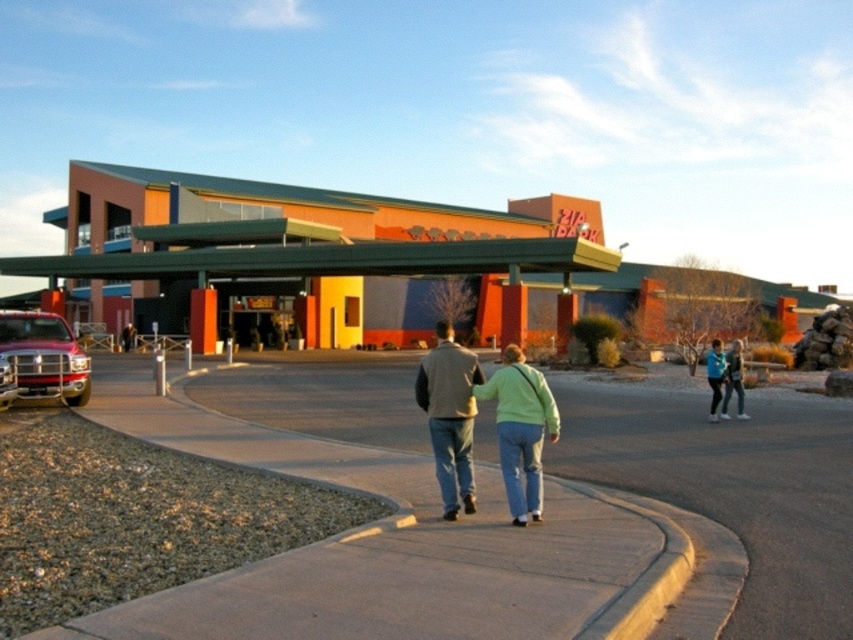
Question: Which point is farther from the camera taking this photo?

Choices:
 (A) (38, 380)
 (B) (467, 561)
 (C) (735, 376)
 (D) (119, 173)

Answer: (D)

Question: Is concrete at center thinner than light blue sweater at center?

Choices:
 (A) no
 (B) yes

Answer: (A)

Question: Is metallic red truck at left thinner than light blue sweater at center?

Choices:
 (A) no
 (B) yes

Answer: (A)

Question: Estimate the real-world distances between objects in this image. Which object is closer to the concrete at center?

Choices:
 (A) light green sweater at center
 (B) orange matte building at center
 (C) gray fleece jacket at center
 (D) light blue sweater at center

Answer: (C)

Question: Which object is positioned closest to the light green sweater at center?

Choices:
 (A) metallic red truck at left
 (B) orange matte building at center
 (C) concrete at center

Answer: (C)

Question: Can you confirm if gray fleece jacket at center is positioned to the left of metallic red truck at left?

Choices:
 (A) yes
 (B) no

Answer: (B)